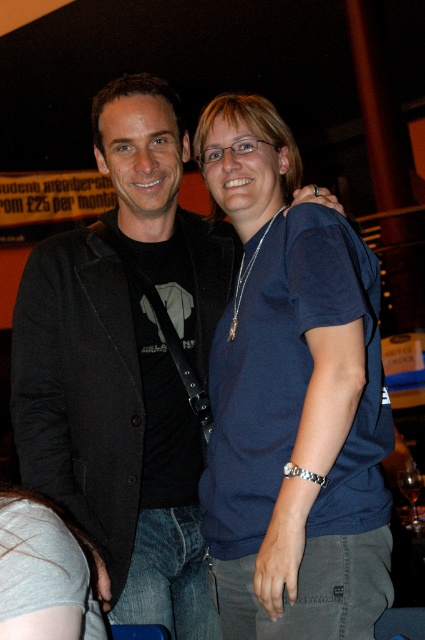
Does black matte jacket at center appear on the right side of gray cotton shirt at lower left?

Yes, black matte jacket at center is to the right of gray cotton shirt at lower left.

Is point (19, 348) closer to camera compared to point (37, 577)?

No, it is behind (37, 577).

Where is `black matte jacket at center`? black matte jacket at center is located at coordinates (110, 429).

Is blue cotton shirt at center positioned at the back of black matte jacket at center?

That is False.

Who is positioned more to the left, blue cotton shirt at center or black matte jacket at center?

From the viewer's perspective, black matte jacket at center appears more on the left side.

Which is behind, point (385, 412) or point (59, 387)?

The point (59, 387) is more distant.

At what (x,y) coordinates should I click in order to perform the action: click on blue cotton shirt at center. Please return your answer as a coordinate pair (x, y). This screenshot has width=425, height=640. Looking at the image, I should click on (291, 401).

Where is `blue cotton shirt at center`? blue cotton shirt at center is located at coordinates (291, 401).

Between blue cotton shirt at center and gray cotton shirt at lower left, which one has less height?

gray cotton shirt at lower left is shorter.

Between point (218, 564) and point (56, 548), which one is positioned in front?

Positioned in front is point (56, 548).

This screenshot has height=640, width=425. I want to click on blue cotton shirt at center, so click(291, 401).